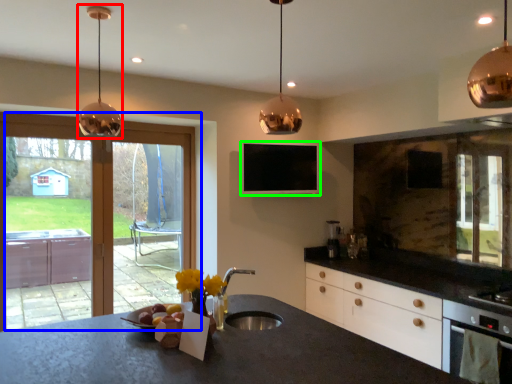
Question: Estimate the real-world distances between objects in this image. Which object is farther from lamp (highlighted by a red box), window (highlighted by a blue box) or window screen (highlighted by a green box)?

Choices:
 (A) window
 (B) window screen

Answer: (B)